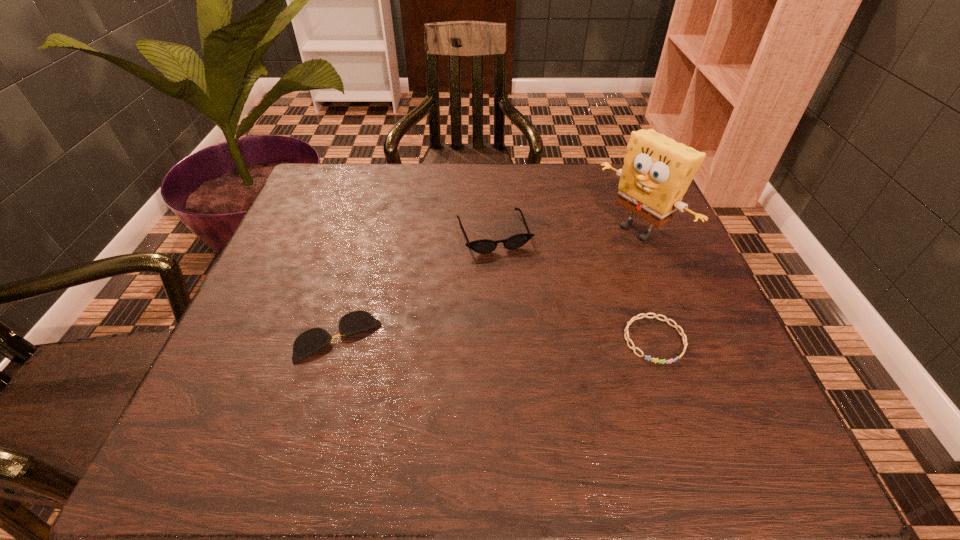
Locate an element on the screen. the shortest object is located at coordinates (314, 339).

Locate an element on the screen. Image resolution: width=960 pixels, height=540 pixels. the leftmost object is located at coordinates pyautogui.click(x=314, y=339).

The width and height of the screenshot is (960, 540). Find the location of `bracelet`. bracelet is located at coordinates (676, 326).

Image resolution: width=960 pixels, height=540 pixels. I want to click on the tallest object, so click(657, 171).

What are the coordinates of `sunglasses` in the screenshot? It's located at (483, 246).

Locate an element on the screen. This screenshot has width=960, height=540. the second tallest object is located at coordinates (483, 246).

You are a GUI agent. You are given a task and a screenshot of the screen. Output one action in this format:
    pyautogui.click(x=<x>, y=<y>)
    Task: Click on the free space located 0.310m on the back of the leftmost object
    
    Given the screenshot: What is the action you would take?
    pyautogui.click(x=372, y=217)

Find the location of a particular element. Image resolution: width=960 pixels, height=540 pixels. vacant position located 0.060m on the surface of the second shortest object showing star-shaped elements is located at coordinates (674, 395).

Locate an element on the screen. This screenshot has width=960, height=540. free space located on the face of the sponge is located at coordinates (577, 271).

Locate an element on the screen. vacant point located 0.330m on the face of the sponge is located at coordinates (501, 316).